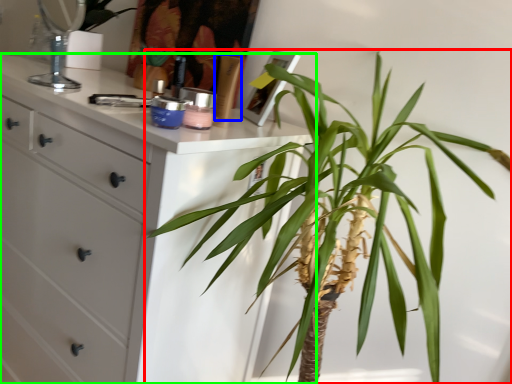
Question: Estimate the real-world distances between objects in this image. Which object is farther from houseplant (highlighted by a red box), toiletry (highlighted by a blue box) or chest of drawers (highlighted by a green box)?

Choices:
 (A) toiletry
 (B) chest of drawers

Answer: (A)